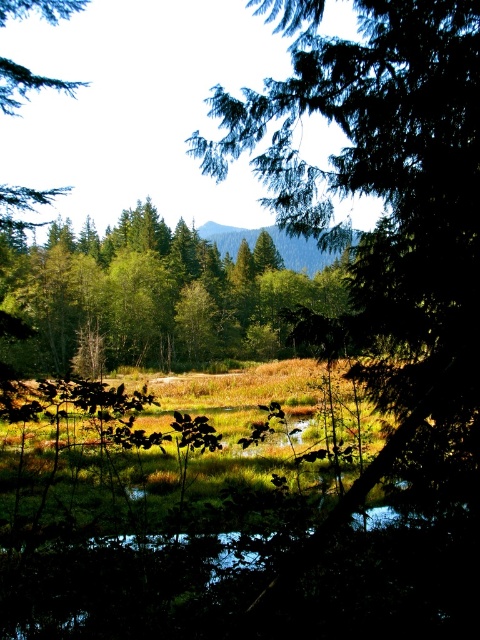
You are a hiker trying to identify two trees in the center of the image. The scene has a green matte tree at center and a green leafy tree at center. Which of these two trees is taller?

The green leafy tree at center is taller than the green matte tree at center.

You are standing at the origin point of the coordinate system in this natural landscape scene. You want to walk towards the green matte tree at center. What direction should you head in?

The green matte tree at center is located at coordinate point 0.317 on the x axis and 0.802 on the y axis. Since you are at the origin point, you should head towards the positive x and positive y direction to reach it.

You are standing in the serene natural landscape described. There is a green matte tree at center located at point (384, 202). If you face directly towards the green matte tree at center, which direction would you need to walk to reach the water in the midground?

The green matte tree at center is located at point (384, 202). Since the water is in the midground, you would need to walk away from the green matte tree at center towards the midground area to reach the water.